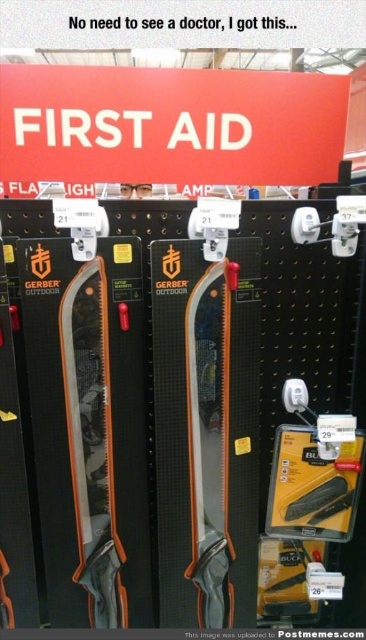
Question: Which of the following is the farthest from the observer?

Choices:
 (A) (98, 548)
 (B) (211, 275)

Answer: (A)

Question: Is matte black saw at center bigger than orange plastic saw at center?

Choices:
 (A) no
 (B) yes

Answer: (B)

Question: Among these objects, which one is nearest to the camera?

Choices:
 (A) orange plastic saw at center
 (B) matte black saw at center

Answer: (B)

Question: Is matte black saw at center to the left of orange plastic saw at center from the viewer's perspective?

Choices:
 (A) yes
 (B) no

Answer: (A)

Question: From the image, what is the correct spatial relationship of matte black saw at center in relation to orange plastic saw at center?

Choices:
 (A) right
 (B) left

Answer: (B)

Question: Among these objects, which one is farthest from the camera?

Choices:
 (A) orange plastic saw at center
 (B) matte black saw at center

Answer: (A)